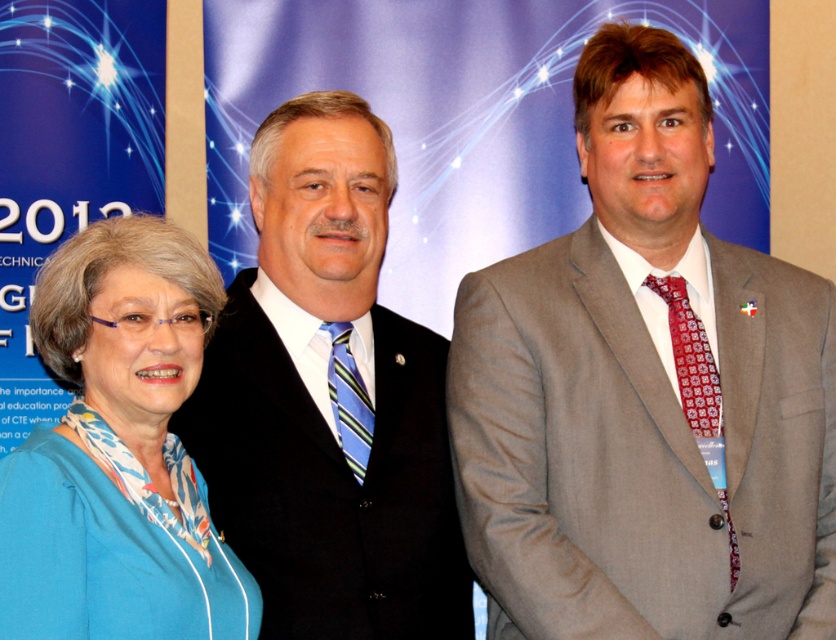
Question: Among these points, which one is farthest from the camera?

Choices:
 (A) (111, 276)
 (B) (376, 632)
 (C) (656, 97)

Answer: (C)

Question: Where is gray suit at center located in relation to blue fabric blouse at center in the image?

Choices:
 (A) left
 (B) right

Answer: (B)

Question: In this image, where is black suit at center located relative to blue fabric blouse at center?

Choices:
 (A) below
 (B) above

Answer: (B)

Question: Which point is closer to the camera taking this photo?

Choices:
 (A) [678, 509]
 (B) [314, 516]

Answer: (A)

Question: Considering the real-world distances, which object is farthest from the gray suit at center?

Choices:
 (A) blue fabric blouse at center
 (B) black suit at center

Answer: (A)

Question: Can you confirm if gray suit at center is positioned above blue fabric blouse at center?

Choices:
 (A) yes
 (B) no

Answer: (A)